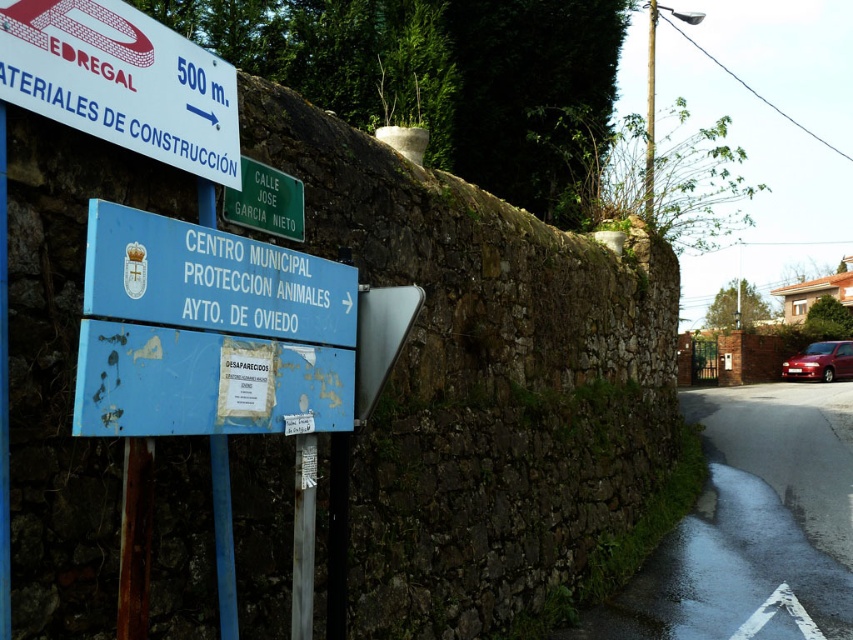
What is the spatial relationship between the blue painted metal sign at center and the green plastic street sign at upper center?

The blue painted metal sign at center is located below the green plastic street sign at upper center.

You are a hiker trying to follow the trail. You see the white plastic sign at upper left and the blue painted metal sign at center. Which sign should you look at first for directions?

You should look at the white plastic sign at upper left first because it is positioned over the blue painted metal sign at center, making it more visible and likely the primary directional indicator.

What is the purpose of the point marked at coordinates (212, 280) in the image?

The point marked at coordinates (212, 280) indicates the location of the blue painted metal sign at center.